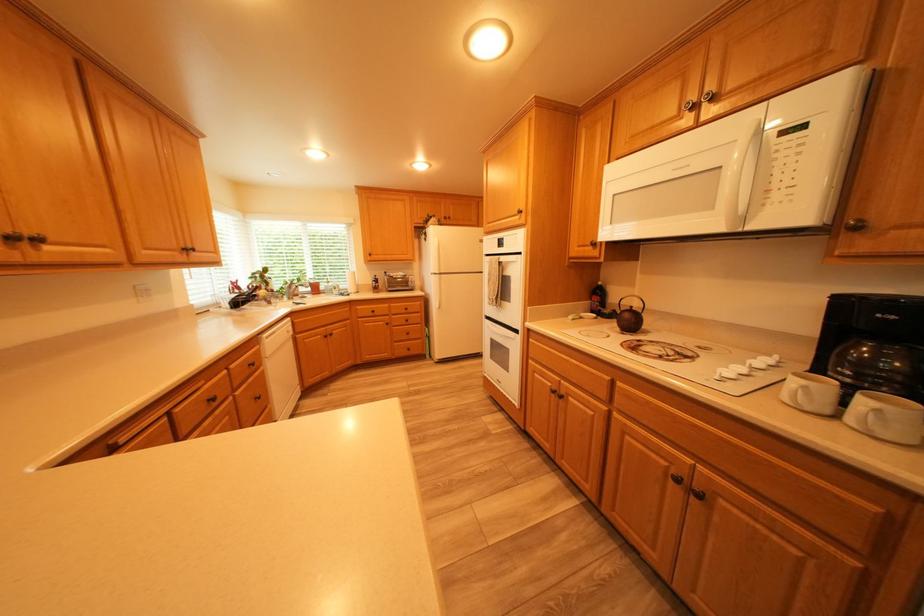
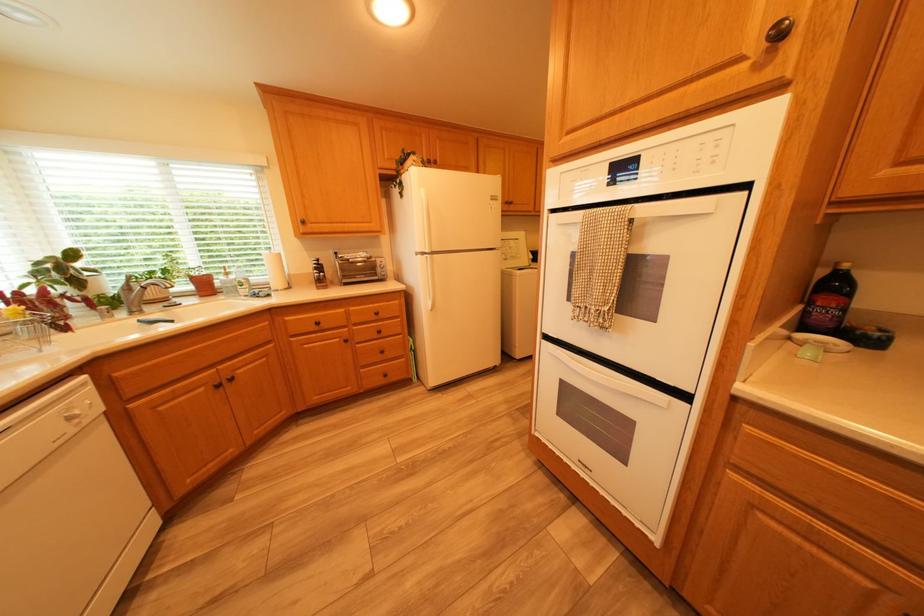
Where in the second image is the point corresponding to pixel 310 294 from the first image?

(162, 300)